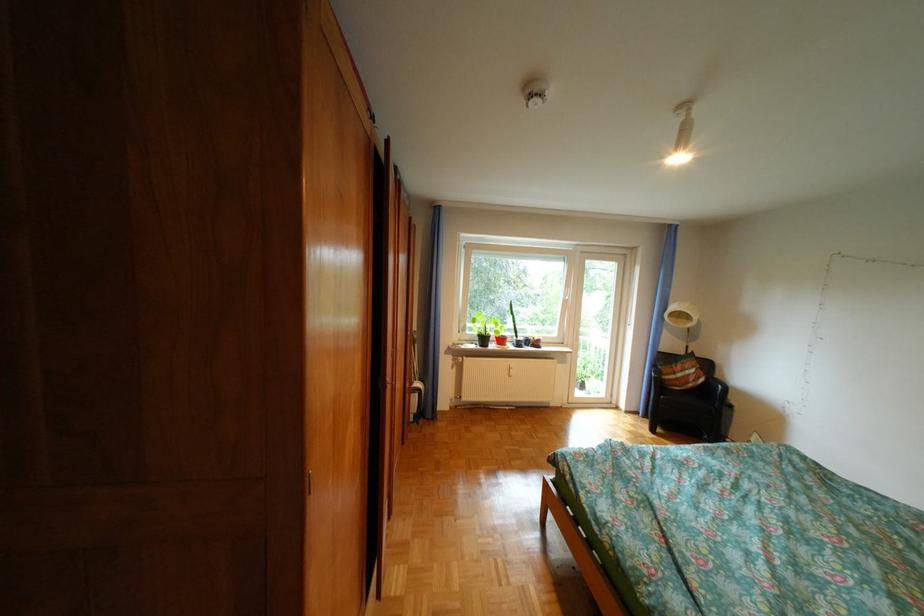
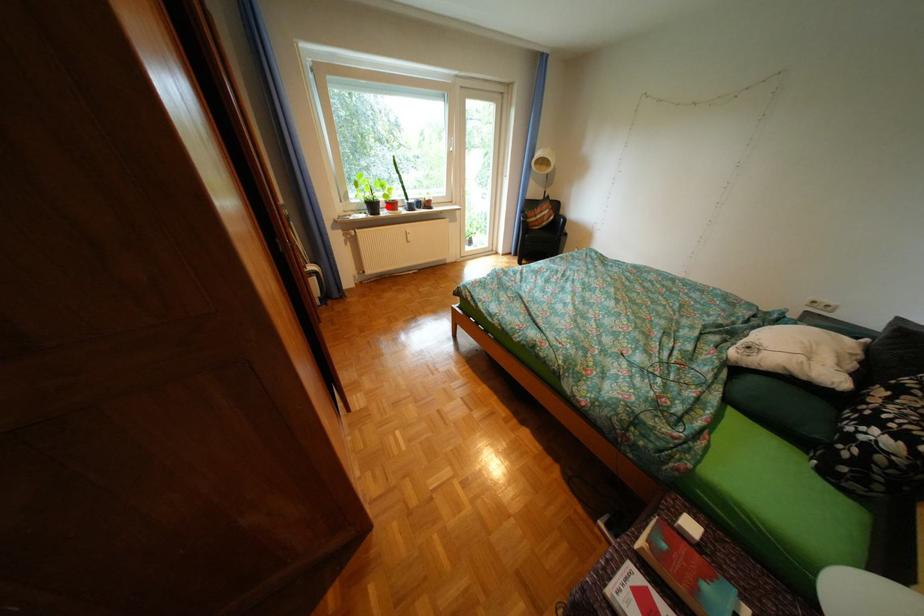
I am providing you with two images of the same scene from different viewpoints. A red point is marked on the first image and another point is marked on the second image. Do the highlighted points in image1 and image2 indicate the same real-world spot?

Yes